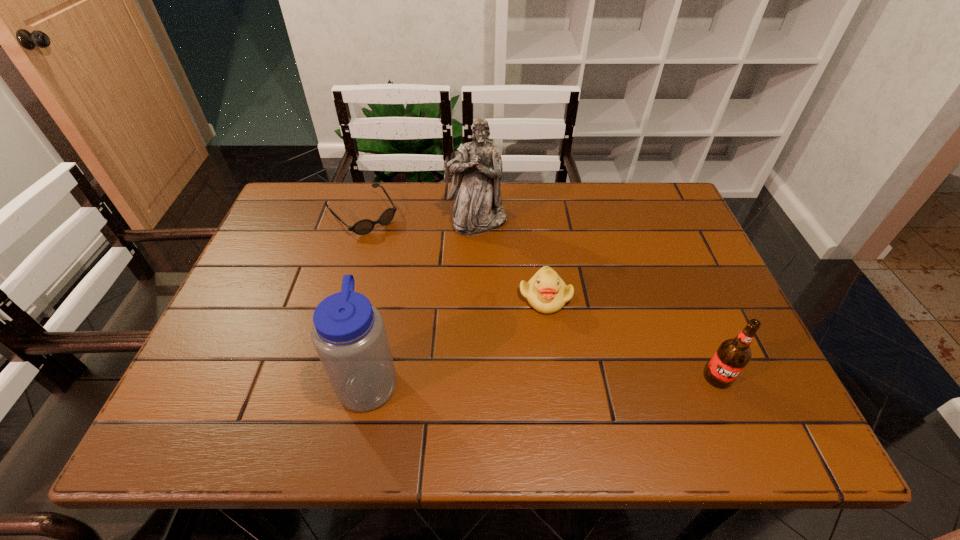
In the image, there is a desktop. Where is `vacant space at the far left corner`? vacant space at the far left corner is located at coordinates (310, 183).

The height and width of the screenshot is (540, 960). What are the coordinates of `free space at the far right corner of the desktop` in the screenshot? It's located at (617, 186).

In order to click on unoccupied area between the duckling and the shortest object in this screenshot , I will do `click(454, 255)`.

Image resolution: width=960 pixels, height=540 pixels. Identify the location of free point between the tallest object and the shortest object. (420, 218).

Locate an element on the screen. This screenshot has height=540, width=960. free point between the water bottle and the rightmost object is located at coordinates (543, 379).

The image size is (960, 540). I want to click on empty location between the duckling and the figurine, so click(x=512, y=259).

The height and width of the screenshot is (540, 960). Find the location of `empty space that is in between the duckling and the figurine`. empty space that is in between the duckling and the figurine is located at coordinates (512, 259).

At what (x,y) coordinates should I click in order to perform the action: click on vacant region between the second shortest object and the fourth shortest object. Please return your answer as a coordinate pair (x, y). The width and height of the screenshot is (960, 540). Looking at the image, I should click on (457, 338).

I want to click on vacant region between the second object from right to left and the second tallest object, so click(x=457, y=338).

The height and width of the screenshot is (540, 960). I want to click on free spot between the figurine and the duckling, so click(x=512, y=259).